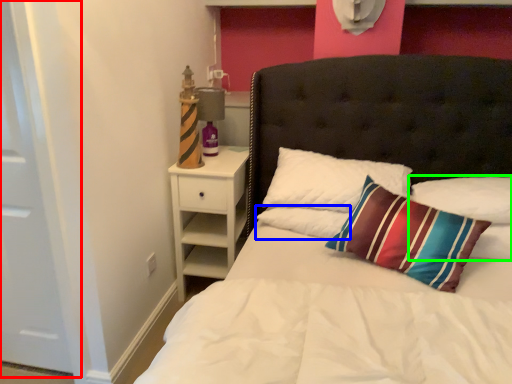
Question: Based on their relative distances, which object is farther from door (highlighted by a red box)? Choose from pillow (highlighted by a blue box) and pillow (highlighted by a green box).

Choices:
 (A) pillow
 (B) pillow

Answer: (B)